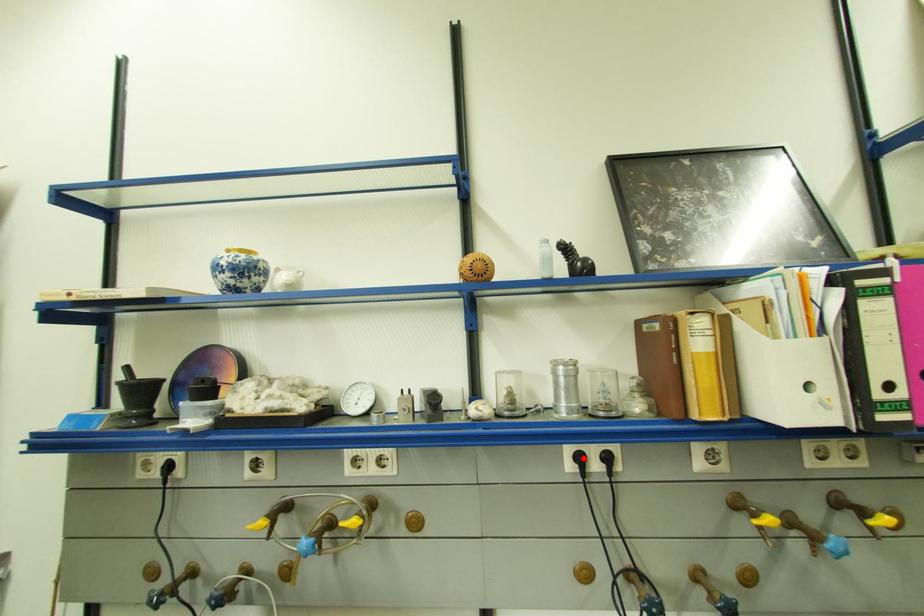
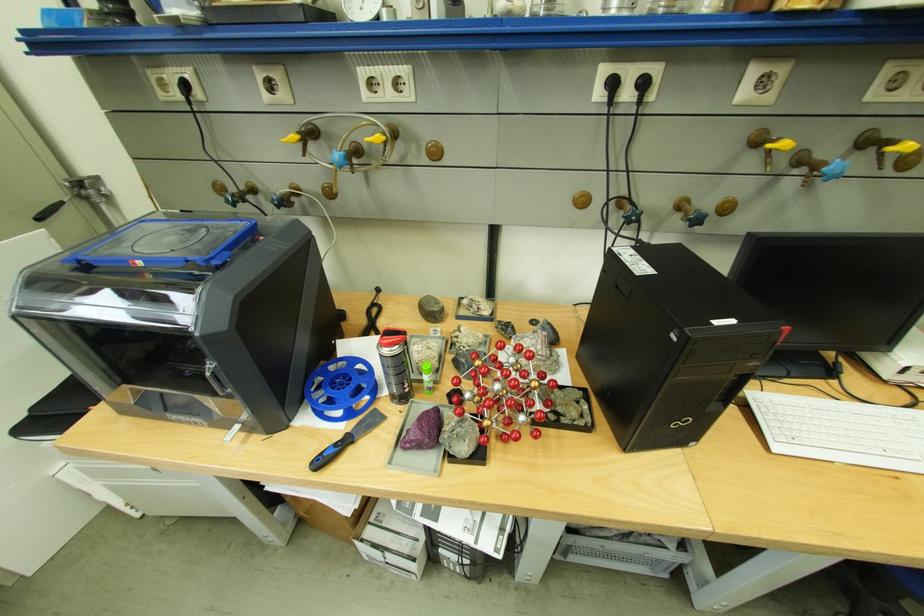
In the second image, find the point that corresponds to the highlighted location in the first image.

(615, 84)